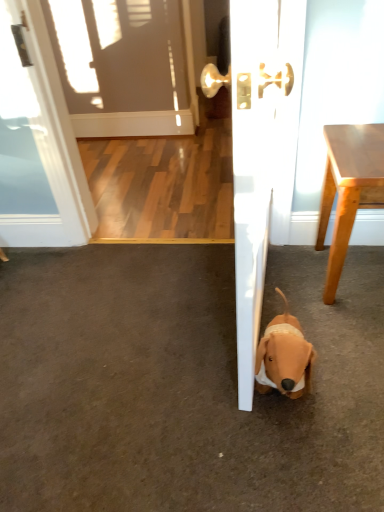
Question: From the image's perspective, does brown plush dog at lower right appear lower than white glossy door at center?

Choices:
 (A) no
 (B) yes

Answer: (B)

Question: From the image's perspective, is brown plush dog at lower right on white glossy door at center?

Choices:
 (A) no
 (B) yes

Answer: (A)

Question: Is brown plush dog at lower right beside white glossy door at center?

Choices:
 (A) no
 (B) yes

Answer: (A)

Question: Is brown plush dog at lower right to the left of white glossy door at center from the viewer's perspective?

Choices:
 (A) no
 (B) yes

Answer: (B)

Question: From a real-world perspective, is brown plush dog at lower right located higher than white glossy door at center?

Choices:
 (A) yes
 (B) no

Answer: (B)

Question: Considering the relative sizes of brown plush dog at lower right and white glossy door at center in the image provided, is brown plush dog at lower right bigger than white glossy door at center?

Choices:
 (A) no
 (B) yes

Answer: (A)

Question: Can we say white glossy door at center lies outside light brown wood table at right?

Choices:
 (A) no
 (B) yes

Answer: (B)

Question: Is white glossy door at center far from light brown wood table at right?

Choices:
 (A) yes
 (B) no

Answer: (B)

Question: Does white glossy door at center have a greater width compared to light brown wood table at right?

Choices:
 (A) no
 (B) yes

Answer: (B)

Question: From the image's perspective, would you say white glossy door at center is positioned over light brown wood table at right?

Choices:
 (A) yes
 (B) no

Answer: (A)

Question: Would you say light brown wood table at right is part of white glossy door at center's contents?

Choices:
 (A) yes
 (B) no

Answer: (B)

Question: Can you confirm if white glossy door at center is positioned to the left of light brown wood table at right?

Choices:
 (A) no
 (B) yes

Answer: (B)

Question: Is light brown wood table at right beside brown plush dog at lower right?

Choices:
 (A) yes
 (B) no

Answer: (B)